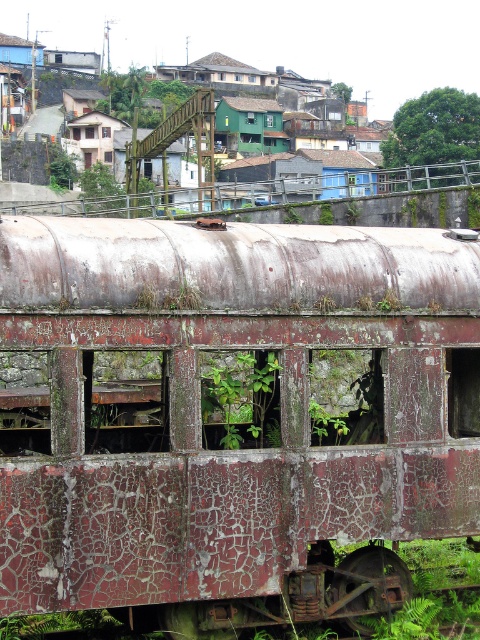
Question: Which of these objects is positioned closest to the green leafy tree at upper right?

Choices:
 (A) green leafy plant at center
 (B) rusty metal train at center

Answer: (B)

Question: Is rusty metal train at center to the right of green leafy plant at center from the viewer's perspective?

Choices:
 (A) no
 (B) yes

Answer: (A)

Question: Is green leafy plant at center smaller than green leafy tree at upper right?

Choices:
 (A) no
 (B) yes

Answer: (B)

Question: Is rusty metal train at center thinner than green leafy plant at center?

Choices:
 (A) yes
 (B) no

Answer: (B)

Question: Among these objects, which one is nearest to the camera?

Choices:
 (A) green leafy tree at upper right
 (B) rusty metal train at center
 (C) green leafy plant at center

Answer: (B)

Question: Which point is farther to the camera?

Choices:
 (A) rusty metal train at center
 (B) green leafy plant at center

Answer: (B)